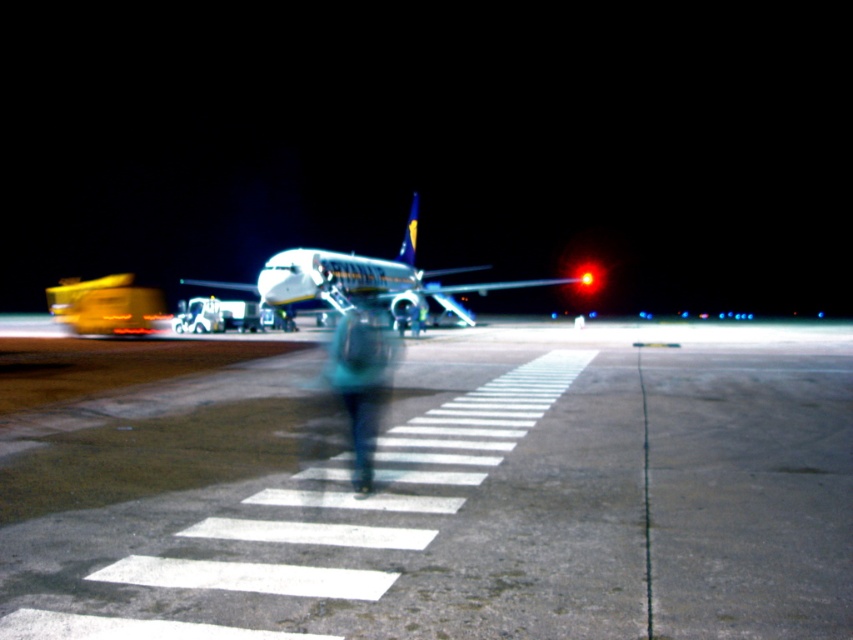
Is white painted lines at center positioned in front of teal fabric jacket at center?

Yes, it is.

Between white painted lines at center and teal fabric jacket at center, which one has less height?

Standing shorter between the two is white painted lines at center.

Does point (206, 596) come behind point (352, 397)?

That is False.

Locate an element on the screen. Image resolution: width=853 pixels, height=640 pixels. white painted lines at center is located at coordinates (450, 493).

Who is positioned more to the left, white glossy airplane at center or teal fabric jacket at center?

From the viewer's perspective, white glossy airplane at center appears more on the left side.

Between white glossy airplane at center and teal fabric jacket at center, which one is positioned lower?

teal fabric jacket at center

Who is more forward, (299, 262) or (357, 401)?

Positioned in front is point (357, 401).

You are a GUI agent. You are given a task and a screenshot of the screen. Output one action in this format:
    pyautogui.click(x=<x>, y=<y>)
    Task: Click on the white glossy airplane at center
    
    Given the screenshot: What is the action you would take?
    pyautogui.click(x=364, y=282)

Is white painted lines at center thinner than white glossy airplane at center?

Incorrect, white painted lines at center's width is not less than white glossy airplane at center's.

Locate an element on the screen. The width and height of the screenshot is (853, 640). white painted lines at center is located at coordinates (450, 493).

Identify the location of white painted lines at center. This screenshot has height=640, width=853. (450, 493).